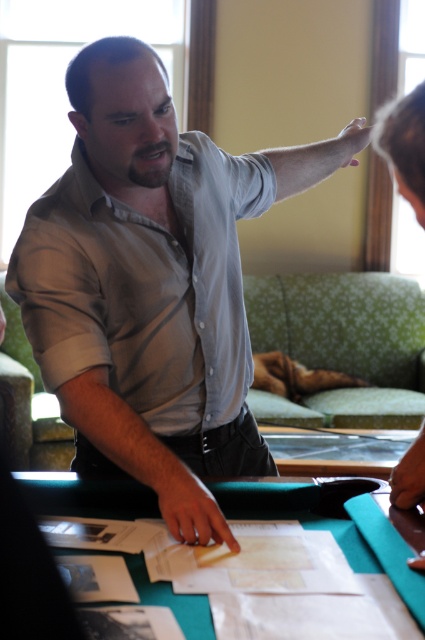
Question: Can you confirm if gray matte shirt at center is positioned to the right of gray fabric arm at upper center?

Choices:
 (A) no
 (B) yes

Answer: (A)

Question: Is matte gray shirt at center bigger than gray fabric arm at upper center?

Choices:
 (A) no
 (B) yes

Answer: (B)

Question: Which object is the closest to the matte gray shirt at upper center?

Choices:
 (A) gray fabric arm at upper center
 (B) green fabric table at lower center

Answer: (A)

Question: Which point is farther to the camera?

Choices:
 (A) (402, 99)
 (B) (271, 150)
 (C) (371, 570)

Answer: (B)

Question: Is matte gray shirt at center further to camera compared to green fabric table at lower center?

Choices:
 (A) no
 (B) yes

Answer: (B)

Question: Which of the following is the farthest from the observer?

Choices:
 (A) (158, 444)
 (B) (110, 563)
 (C) (312, 177)
 (D) (203, 524)

Answer: (C)